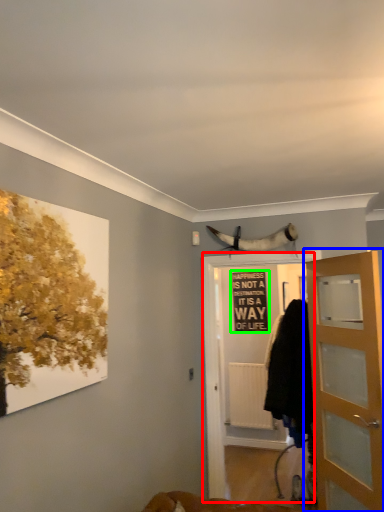
Question: Considering the real-world distances, which object is closest to screen door (highlighted by a red box)? door (highlighted by a blue box) or bulletin board (highlighted by a green box).

Choices:
 (A) door
 (B) bulletin board

Answer: (A)